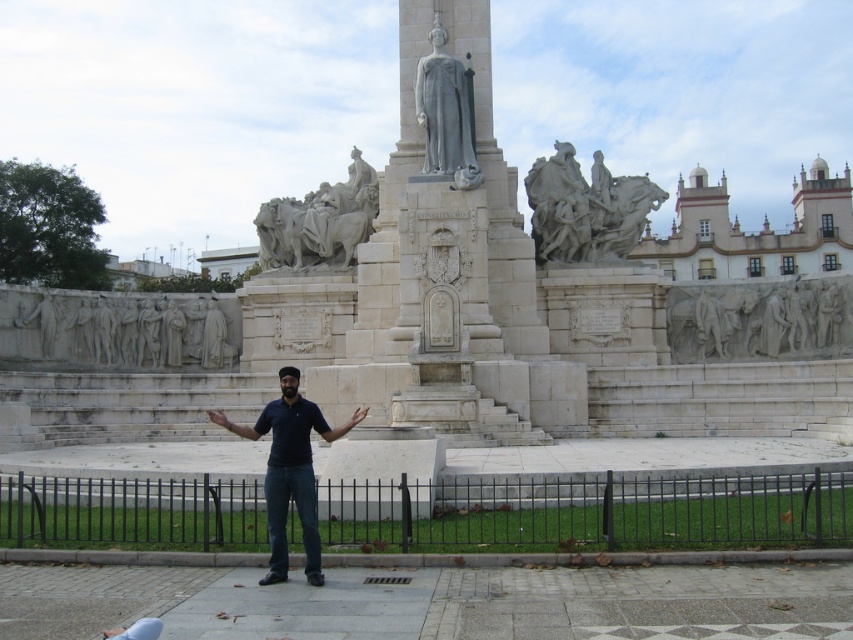
You are standing in the public square and want to take a photo of the monument. Your camera has a maximum focus range of 300 feet. Is the point at coordinates point [358,154] within the camera focus range?

The point at coordinates point [358,154] is 290.14 feet from the camera, which is within the maximum focus range of 300 feet. Yes, the camera can focus on it.

You are standing at the base of the monument and want to take a photo of the point at coordinate point (x=27, y=316). If your camera has a maximum zoom range of 200 feet, will you be able to capture the point clearly in your photo?

The point at coordinate point (x=27, y=316) is 254.39 feet away from the camera. Since the camera can only zoom up to 200 feet, it will not be able to capture the point clearly in the photo.

Looking at this image, you are a tourist standing in front of the monument. You see the white stone relief at lower left and the white marble statues at upper center. Which object is positioned to the left of the other?

The white stone relief at lower left is positioned to the left of the white marble statues at upper center.